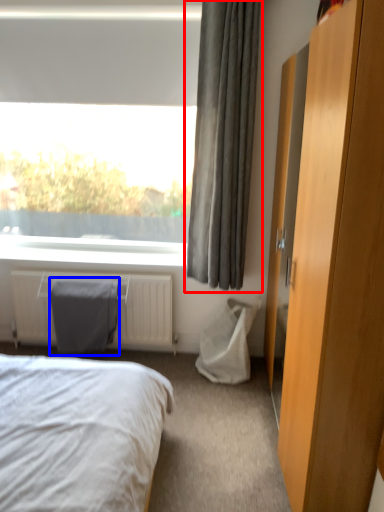
Question: Which of the following is the closest to the observer, curtain (highlighted by a red box) or gray (highlighted by a blue box)?

Choices:
 (A) curtain
 (B) gray

Answer: (A)